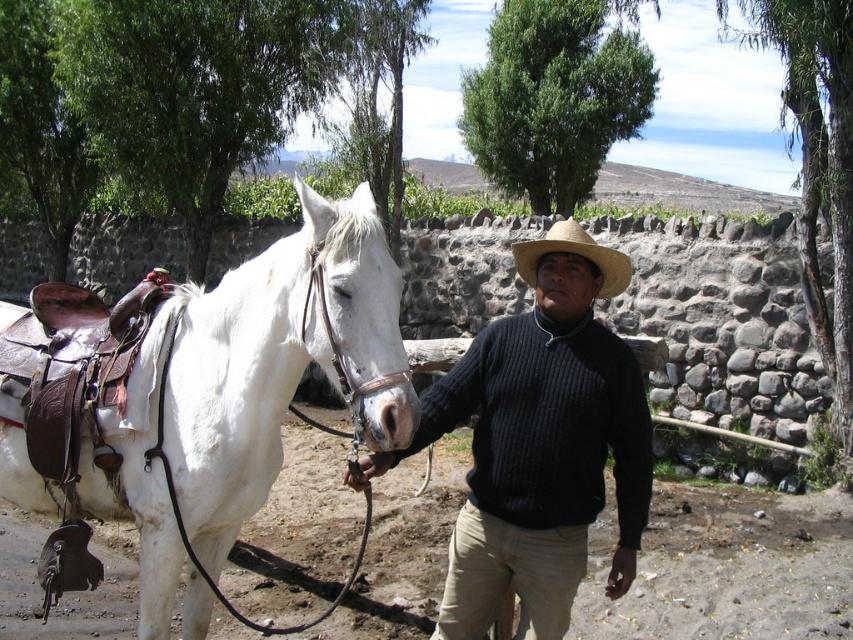
Can you confirm if knitted dark blue sweater at center is bigger than straw hat at center?

Correct, knitted dark blue sweater at center is larger in size than straw hat at center.

Is point (535, 481) farther from camera compared to point (606, 276)?

No, (535, 481) is closer to viewer.

Locate an element on the screen. knitted dark blue sweater at center is located at coordinates pos(540,444).

Is point (331, 205) farther from camera compared to point (567, 326)?

No, it is in front of (567, 326).

Does white leather saddle at left have a larger size compared to knitted dark blue sweater at center?

Yes, white leather saddle at left is bigger than knitted dark blue sweater at center.

Is point (154, 356) more distant than point (350, 480)?

Yes, point (154, 356) is farther from viewer.

This screenshot has width=853, height=640. Find the location of `white leather saddle at left`. white leather saddle at left is located at coordinates (193, 397).

Can you confirm if white leather saddle at left is positioned to the left of straw hat at center?

Yes, white leather saddle at left is to the left of straw hat at center.

Can you confirm if white leather saddle at left is positioned above straw hat at center?

Incorrect, white leather saddle at left is not positioned above straw hat at center.

Describe the element at coordinates (193, 397) in the screenshot. I see `white leather saddle at left` at that location.

Image resolution: width=853 pixels, height=640 pixels. Identify the location of white leather saddle at left. (193, 397).